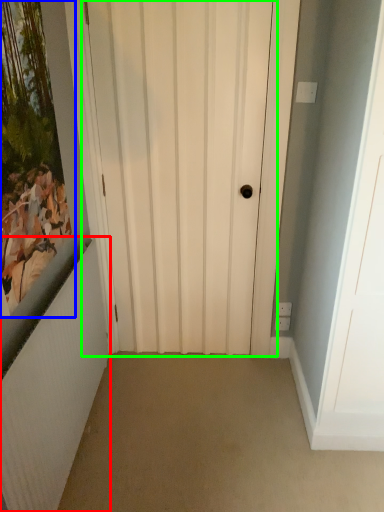
Question: Estimate the real-world distances between objects in this image. Which object is closer to radiator (highlighted by a red box), picture frame (highlighted by a blue box) or door (highlighted by a green box)?

Choices:
 (A) picture frame
 (B) door

Answer: (A)